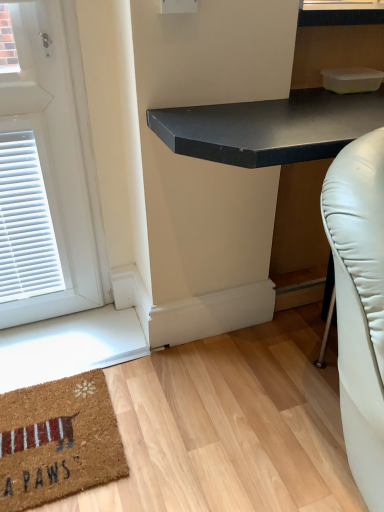
The height and width of the screenshot is (512, 384). Identify the location of vacant area that lies between black matte desk at center and brown coir mat at lower left. (167, 404).